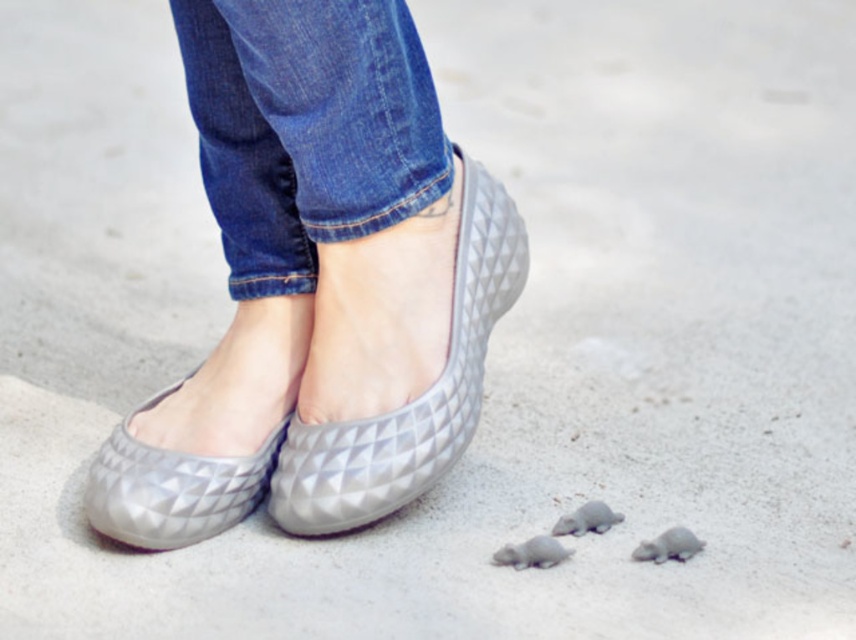
You are standing in front of the person and looking at their shoes and jeans. There are two points marked on the image. Which point is closer to you, point (289, 516) or point (547, 538)?

Point (547, 538) is closer to you because it is in front of point (289, 516).

You are a photographer setting up a shoot. You need to position a matte rubber turtle at lower center so that it is partially hidden by the matte gray shoes at center. Is the current arrangement in the image suitable for this requirement?

Yes, the current arrangement is suitable because the matte gray shoes at center is in front of the matte rubber turtle at lower center, partially hiding it.

You are a photographer setting up a shoot focusing on the matte gray shoes at center. You notice the matte rubber mouse at lower center nearby. To ensure the shoes are the main focus, should you move the mouse closer to or farther away from the shoes?

The matte gray shoes at center is taller than the matte rubber mouse at lower center. To make the shoes the main focus, you should move the mouse farther away from the shoes so it doesn not distract from the shoes.